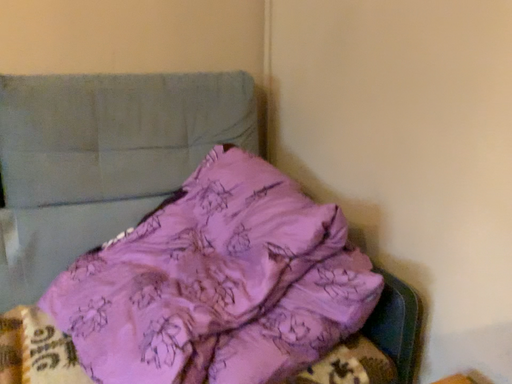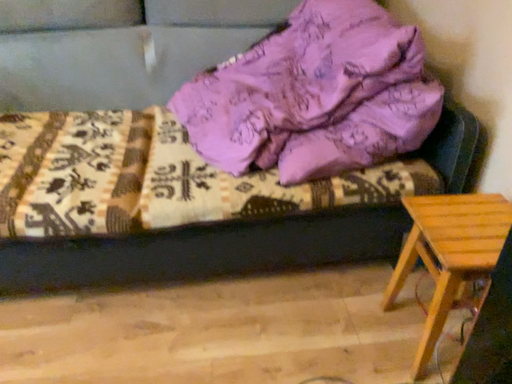
Question: Which way did the camera rotate in the video?

Choices:
 (A) rotated upward
 (B) rotated downward

Answer: (B)